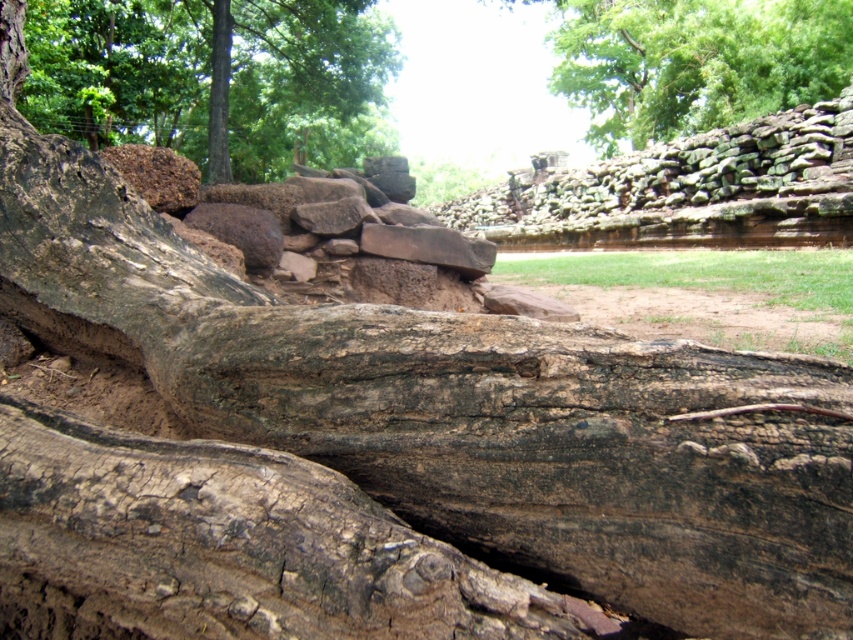
You are standing in the outdoor scene and want to take a photo. You notice two points marked in the image. Which point is closer to your camera lens, point (199, 13) or point (796, 140)?

Point (199, 13) is further to the camera than point (796, 140). Wait, no. The description says the first point is further to the camera than the second, so the second point is closer. Therefore, point (796, 140) is closer to the camera lens.

From the picture: You are a painter standing at the base of the large fallen tree trunk. You want to set up your easel so that you can paint both the green leafy tree at upper center and the rustic stone wall at upper center without moving it. What is the minimum distance your easel needs to be from both objects to ensure they are both in your painting?

The minimum distance your easel needs to be from both the green leafy tree at upper center and the rustic stone wall at upper center is 17.98 feet apart from each other. This distance ensures both objects are within the painting as they are positioned 17.98 feet apart.

You are standing at the origin point of the image and want to place a small garden ornament exactly at point (120, 72). What object is located there?

The brown rough tree trunk at upper left is located at point (120, 72).